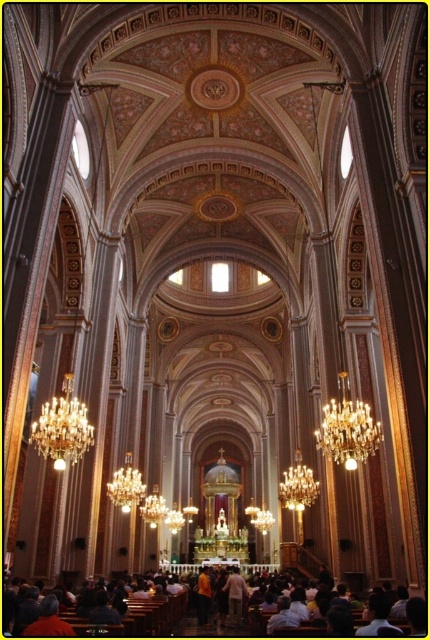
Question: Is crystal gold chandelier at center positioned behind light beige fabric at center?

Choices:
 (A) no
 (B) yes

Answer: (A)

Question: Can you confirm if crystal gold chandelier at center is positioned above light beige fabric at center?

Choices:
 (A) yes
 (B) no

Answer: (A)

Question: Estimate the real-world distances between objects in this image. Which object is closer to the light brown wooden pew at lower center?

Choices:
 (A) light beige fabric at center
 (B) golden metallic chandelier at center
 (C) gold crystal chandelier at left

Answer: (C)

Question: Which point is farther from the camera taking this photo?

Choices:
 (A) (144, 621)
 (B) (70, 449)
 (C) (295, 502)
 (D) (325, 417)

Answer: (C)

Question: Does light brown wooden pew at lower center have a lesser width compared to golden metallic chandelier at center?

Choices:
 (A) yes
 (B) no

Answer: (B)

Question: Which of the following is the closest to the observer?

Choices:
 (A) light beige fabric at center
 (B) light brown wooden pew at lower center
 (C) crystal gold chandelier at center
 (D) gold crystal chandelier at left

Answer: (B)